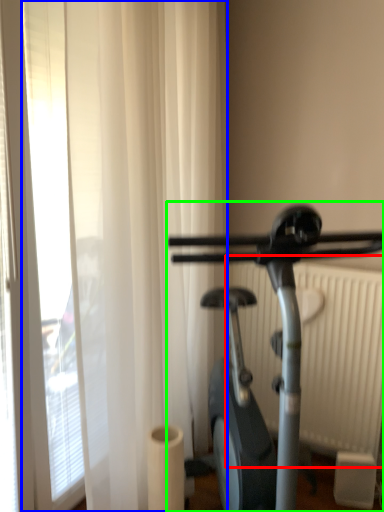
Question: Which is farther away from radiator (highlighted by a red box)? shower curtain (highlighted by a blue box) or stationary bicycle (highlighted by a green box)?

Choices:
 (A) shower curtain
 (B) stationary bicycle

Answer: (B)